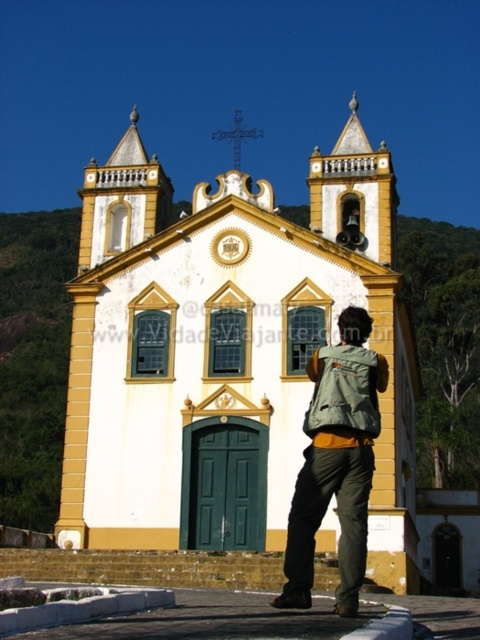
Question: Which of the following is the farthest from the observer?

Choices:
 (A) green canvas backpack at lower center
 (B) green fabric backpack at center

Answer: (A)

Question: Which point is farther to the camera?

Choices:
 (A) yellow painted stone church at center
 (B) green canvas backpack at lower center
 (C) green fabric backpack at center

Answer: (A)

Question: Which point appears farthest from the camera in this image?

Choices:
 (A) (309, 420)
 (B) (377, 385)

Answer: (B)

Question: Where is yellow painted stone church at center located in relation to green fabric backpack at center in the image?

Choices:
 (A) right
 (B) left

Answer: (B)

Question: Can you confirm if green fabric backpack at center is positioned to the left of green canvas backpack at lower center?

Choices:
 (A) yes
 (B) no

Answer: (B)

Question: Observing the image, what is the correct spatial positioning of green fabric backpack at center in reference to green canvas backpack at lower center?

Choices:
 (A) left
 (B) right

Answer: (B)